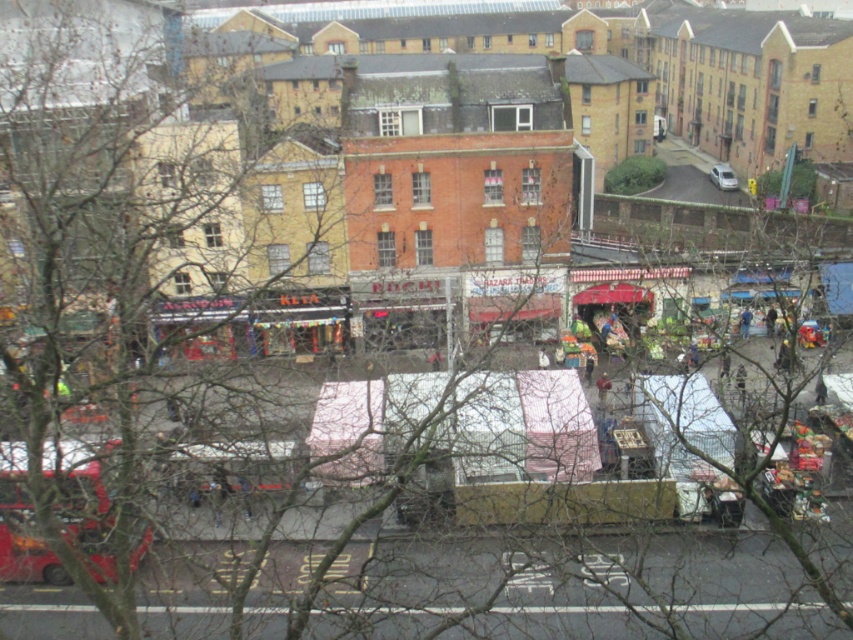
Question: Which of the following is the farthest from the observer?

Choices:
 (A) white matte van at upper right
 (B) brown leather jacket at center

Answer: (A)

Question: Which object appears farthest from the camera in this image?

Choices:
 (A) white matte van at upper right
 (B) blue fabric at center
 (C) brown leather jacket at center
 (D) red matte bus at lower left

Answer: (A)

Question: Based on their relative distances, which object is farther from the brown leather jacket at center?

Choices:
 (A) red matte bus at lower left
 (B) blue fabric at center
 (C) white matte van at upper right

Answer: (C)

Question: Is white matte van at upper right below blue fabric at center?

Choices:
 (A) no
 (B) yes

Answer: (A)

Question: Does brown leather jacket at center have a smaller size compared to blue fabric at center?

Choices:
 (A) yes
 (B) no

Answer: (B)

Question: Is the position of brown leather jacket at center less distant than that of blue fabric at center?

Choices:
 (A) yes
 (B) no

Answer: (A)